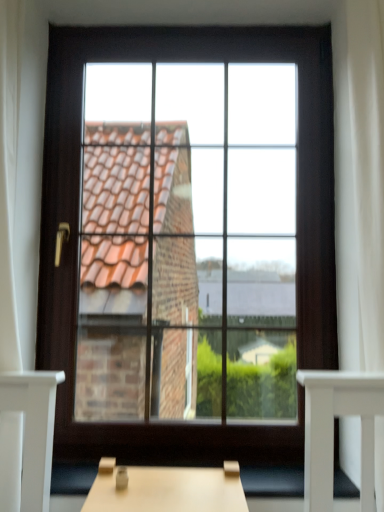
The width and height of the screenshot is (384, 512). I want to click on dark wood window at center, so click(187, 240).

The width and height of the screenshot is (384, 512). What do you see at coordinates (187, 240) in the screenshot? I see `dark wood window at center` at bounding box center [187, 240].

You are a GUI agent. You are given a task and a screenshot of the screen. Output one action in this format:
    pyautogui.click(x=<x>, y=<y>)
    Task: Click on the dark wood window at center
    
    Given the screenshot: What is the action you would take?
    pyautogui.click(x=187, y=240)